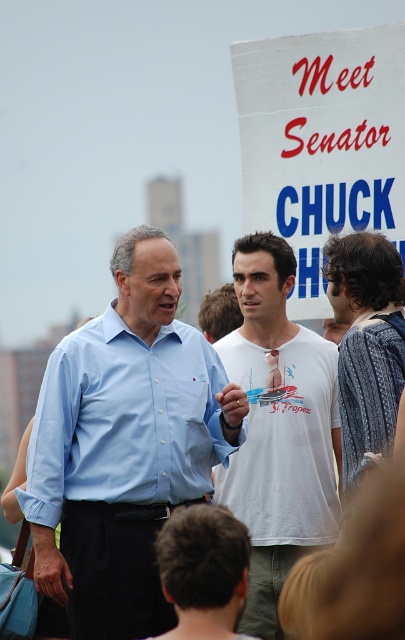
You are a photographer at the event and want to capture a photo that includes both the white paper sign at upper center and the patterned fabric shirt at right. Based on their positions, which object should be placed on the left side of the photo frame to include both?

The white paper sign at upper center should be placed on the left side of the photo frame because it is already positioned to the left of the patterned fabric shirt at right in the scene.

You are standing at point (181, 513) and want to move to point (149, 394). Is the path clear between these two points?

Point (149, 394) is behind point (181, 513), so the path between them is blocked by the object at point (181, 513).